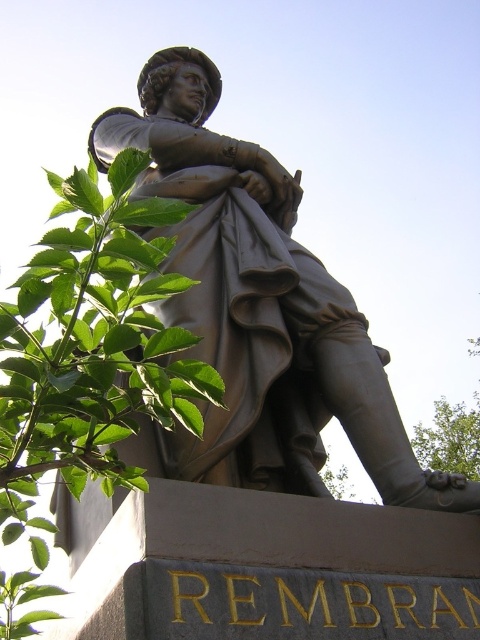
You are an art student standing in front of the bronze statue at center and the green leafy branch at upper left. Which object is taller?

The bronze statue at center is taller than the green leafy branch at upper left according to the description.

You are standing in front of the bronze statue at center and want to take a photo of it. There is a green leafy branch at upper left in the background. Will the branch block the statue in your photo?

The bronze statue at center is further to the viewer than the green leafy branch at upper left, so the branch will not block the statue in your photo because it is behind the statue.

Consider the image. You are an art student standing in front of the bronze statue at center and the green leafy branch at upper left. Your teacher asks you to compare their sizes. Which one is wider?

The bronze statue at center is wider than the green leafy branch at upper left.